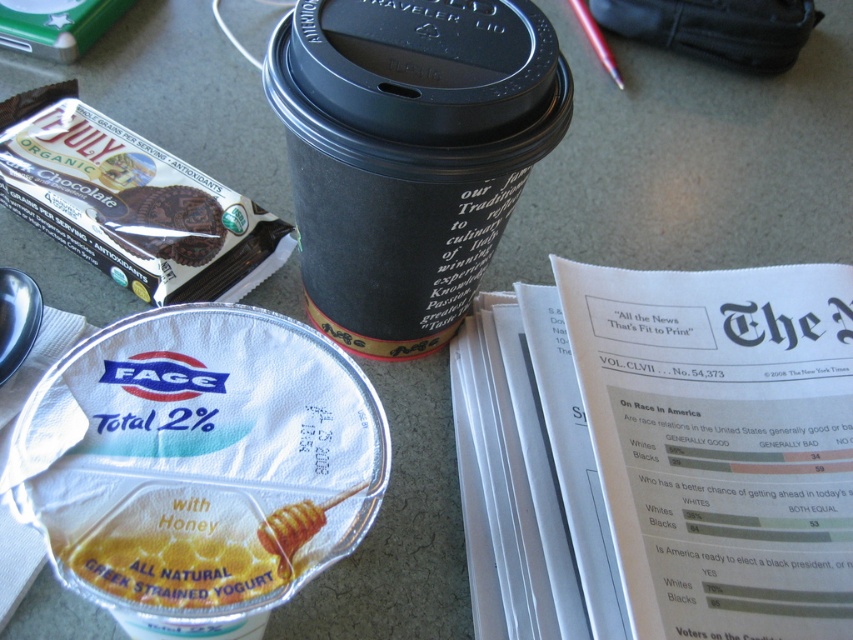
Question: Which object appears farthest from the camera in this image?

Choices:
 (A) chocolate wafer at upper left
 (B) metallic red pen at upper center

Answer: (B)

Question: Which object is farther from the camera taking this photo?

Choices:
 (A) chocolate wafer at upper left
 (B) black paper cup at upper center

Answer: (A)

Question: Is black paper cup at upper center smaller than metallic red pen at upper center?

Choices:
 (A) no
 (B) yes

Answer: (A)

Question: Is black paper cup at upper center to the left of chocolate wafer at upper left from the viewer's perspective?

Choices:
 (A) yes
 (B) no

Answer: (B)

Question: Estimate the real-world distances between objects in this image. Which object is farther from the black paper cup at upper center?

Choices:
 (A) chocolate wafer at upper left
 (B) metallic red pen at upper center

Answer: (B)

Question: Does chocolate wafer at upper left have a larger size compared to metallic red pen at upper center?

Choices:
 (A) yes
 (B) no

Answer: (B)